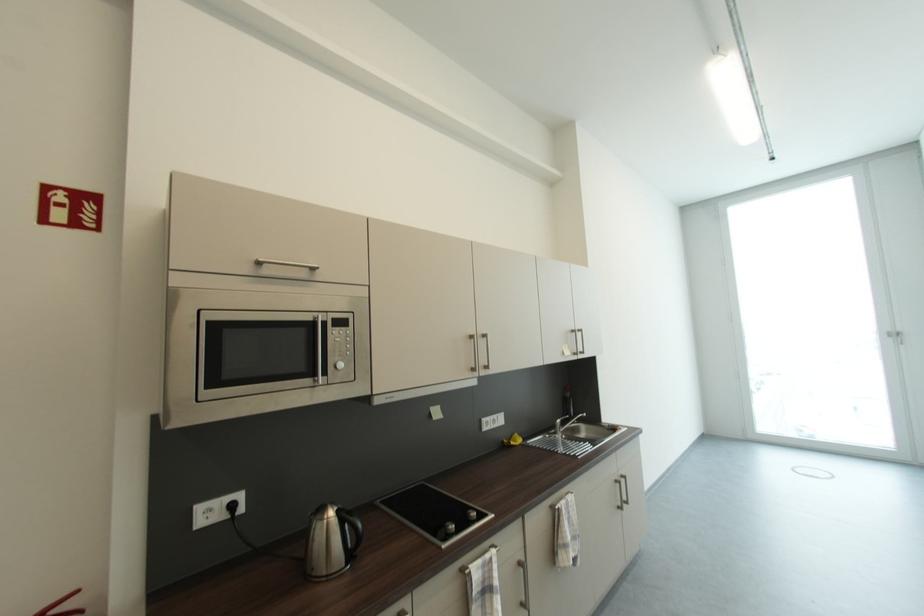
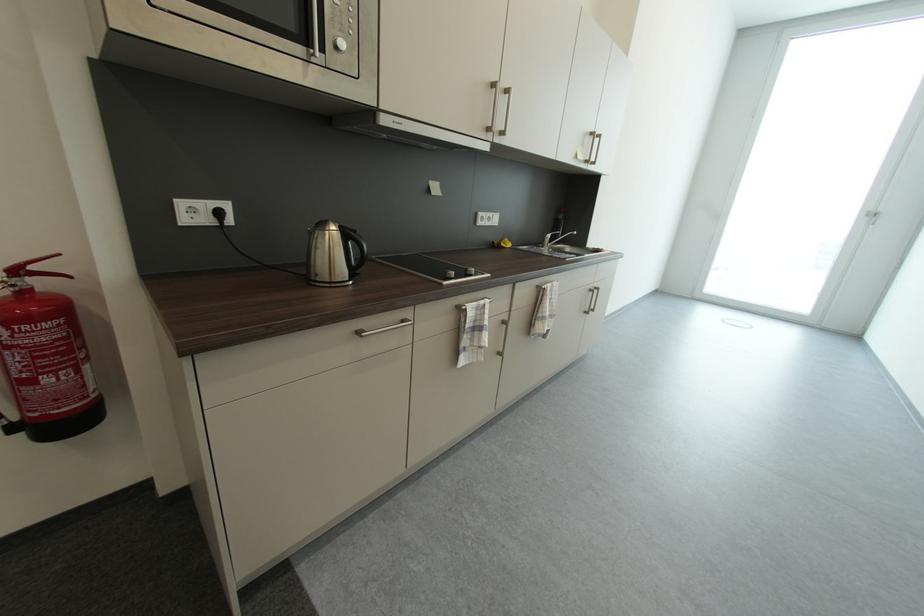
The point at (x=511, y=444) is marked in the first image. Where is the corresponding point in the second image?

(501, 244)